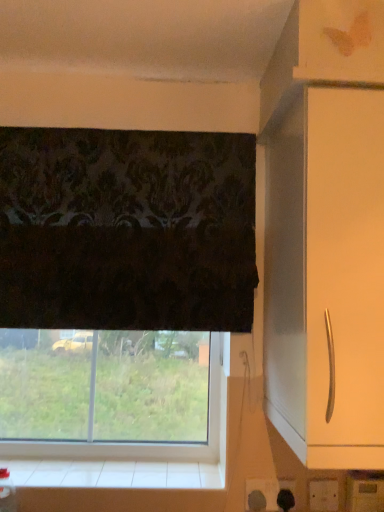
Question: Does white glossy cabinet handle at right have a lesser width compared to transparent glass window at lower center?

Choices:
 (A) yes
 (B) no

Answer: (B)

Question: Is white glossy cabinet handle at right facing towards transparent glass window at lower center?

Choices:
 (A) no
 (B) yes

Answer: (A)

Question: Does white glossy cabinet handle at right have a greater width compared to transparent glass window at lower center?

Choices:
 (A) yes
 (B) no

Answer: (A)

Question: From a real-world perspective, is white glossy cabinet handle at right positioned under transparent glass window at lower center based on gravity?

Choices:
 (A) no
 (B) yes

Answer: (A)

Question: Are white glossy cabinet handle at right and transparent glass window at lower center making contact?

Choices:
 (A) no
 (B) yes

Answer: (A)

Question: From the image's perspective, is transparent glass window at lower center located above or below white tile at lower center?

Choices:
 (A) below
 (B) above

Answer: (B)

Question: Looking at the image, does transparent glass window at lower center seem bigger or smaller compared to white tile at lower center?

Choices:
 (A) small
 (B) big

Answer: (B)

Question: Is point (187, 456) positioned closer to the camera than point (46, 458)?

Choices:
 (A) closer
 (B) farther

Answer: (A)

Question: From their relative heights in the image, would you say transparent glass window at lower center is taller or shorter than white tile at lower center?

Choices:
 (A) short
 (B) tall

Answer: (B)

Question: Is white glossy cabinet handle at right wider or thinner than white tile at lower center?

Choices:
 (A) thin
 (B) wide

Answer: (B)

Question: In the image, is white glossy cabinet handle at right positioned in front of or behind white tile at lower center?

Choices:
 (A) behind
 (B) front

Answer: (B)

Question: Visually, is white glossy cabinet handle at right positioned to the left or to the right of white tile at lower center?

Choices:
 (A) left
 (B) right

Answer: (B)

Question: From their relative heights in the image, would you say white glossy cabinet handle at right is taller or shorter than white tile at lower center?

Choices:
 (A) tall
 (B) short

Answer: (A)

Question: In the image, is white tile at lower center positioned in front of or behind transparent glass window at lower center?

Choices:
 (A) front
 (B) behind

Answer: (A)

Question: Is point (153, 453) closer or farther from the camera than point (175, 454)?

Choices:
 (A) farther
 (B) closer

Answer: (A)